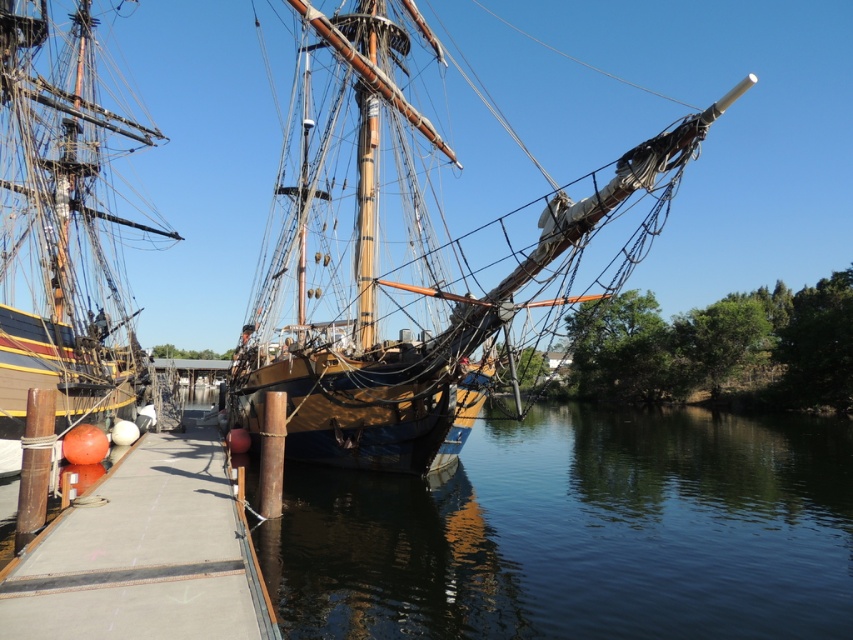
You are standing on the pier and see the wooden ship at center and the concrete at center. Which object is closer to you?

The wooden ship at center is positioned over concrete at center, so the wooden ship at center is closer to you.

You are standing on the pier and looking at the historic sailing ship. There are two points marked on the ship, one at coordinates point (276, 561) and another at point (85, 188). Which of these points is closer to you?

Point (276, 561) is closer to the viewer than point (85, 188).